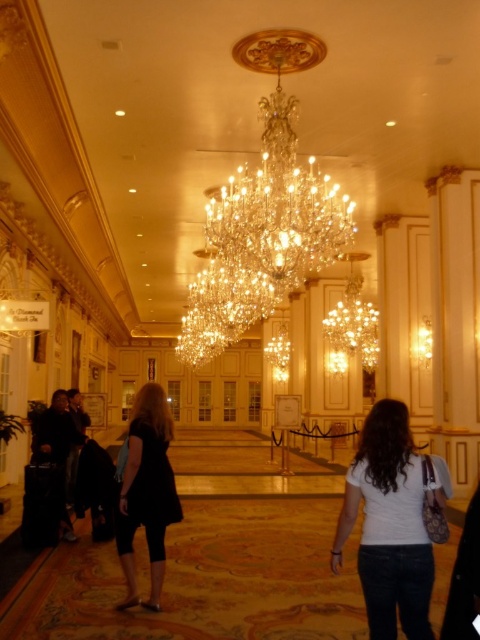
Who is lower down, white matte shirt at lower right or black matte dress at center?

Positioned lower is black matte dress at center.

Does white matte shirt at lower right have a larger size compared to black matte dress at center?

Actually, white matte shirt at lower right might be smaller than black matte dress at center.

Locate an element on the screen. white matte shirt at lower right is located at coordinates click(x=388, y=525).

The width and height of the screenshot is (480, 640). I want to click on white matte shirt at lower right, so click(388, 525).